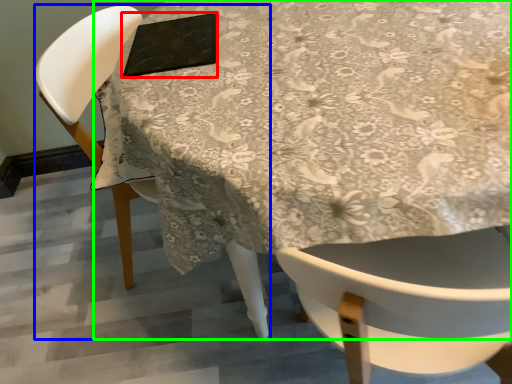
Question: Which object is positioned closest to pad (highlighted by a red box)? Select from chair (highlighted by a blue box) and table (highlighted by a green box).

Choices:
 (A) chair
 (B) table

Answer: (B)